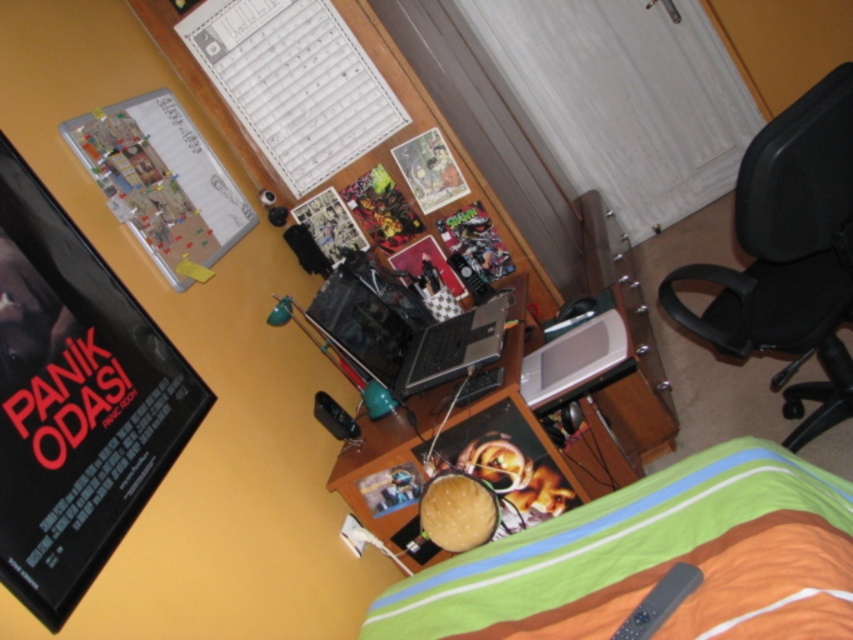
Question: Which object appears farthest from the camera in this image?

Choices:
 (A) black plastic swivel chair at right
 (B) metallic silver laptop at center
 (C) green striped fabric bed at lower right
 (D) shiny black laptop at center

Answer: (D)

Question: Among these points, which one is nearest to the camera?

Choices:
 (A) (384, 448)
 (B) (447, 352)

Answer: (A)

Question: Observing the image, what is the correct spatial positioning of green striped fabric bed at lower right in reference to shiny black laptop at center?

Choices:
 (A) left
 (B) right

Answer: (B)

Question: Does black plastic swivel chair at right have a larger size compared to shiny black laptop at center?

Choices:
 (A) yes
 (B) no

Answer: (A)

Question: Estimate the real-world distances between objects in this image. Which object is farther from the black plastic swivel chair at right?

Choices:
 (A) green striped fabric bed at lower right
 (B) metallic silver laptop at center

Answer: (A)

Question: Can you confirm if green striped fabric bed at lower right is positioned to the right of shiny black laptop at center?

Choices:
 (A) yes
 (B) no

Answer: (A)